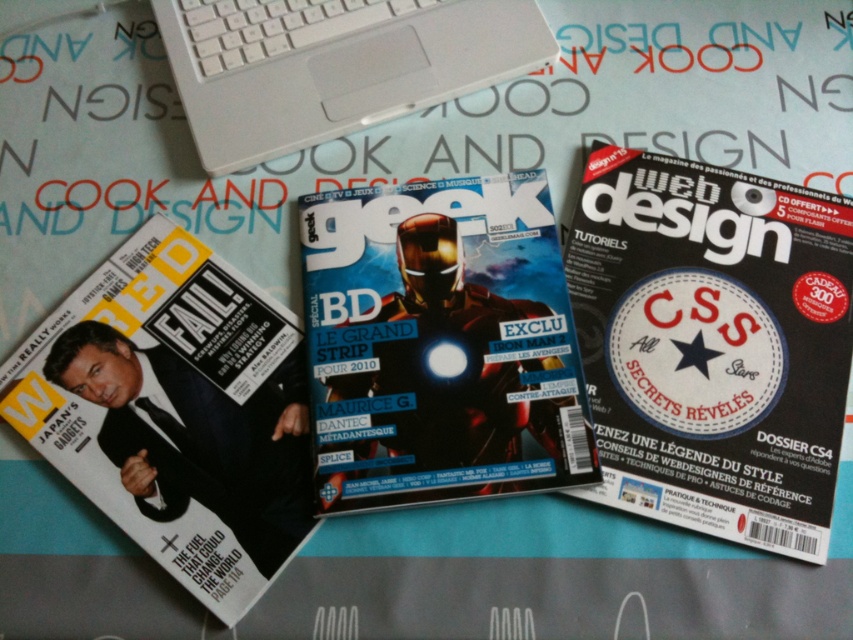
You are a photographer trying to capture both the magazine titled Red Fail and the magazine titled Geek in a single shot. The magazines are positioned at point coordinates point [761,248] and point [38,326] respectively. Considering the depth of field, which magazine should you focus on to ensure both are in focus?

You should focus on the magazine at point [38,326] because it is closer to the viewer than the magazine at point [761,248], ensuring both are within the depth of field.

You are organizing a display and need to place both the metallic silver magazine at center and the matte black magazine at lower left side by side. Which magazine should you place first if you want the wider one to be on the left?

The matte black magazine at lower left is wider than the metallic silver magazine at center. To have the wider one on the left, place the matte black magazine at lower left first.